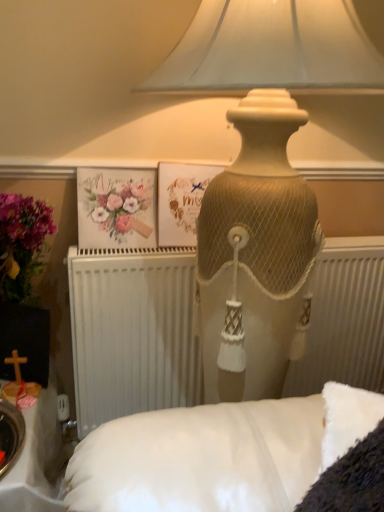
Find the location of a particular element. The height and width of the screenshot is (512, 384). vacant area that lies in front of watercolor paper flowers at upper left is located at coordinates (107, 255).